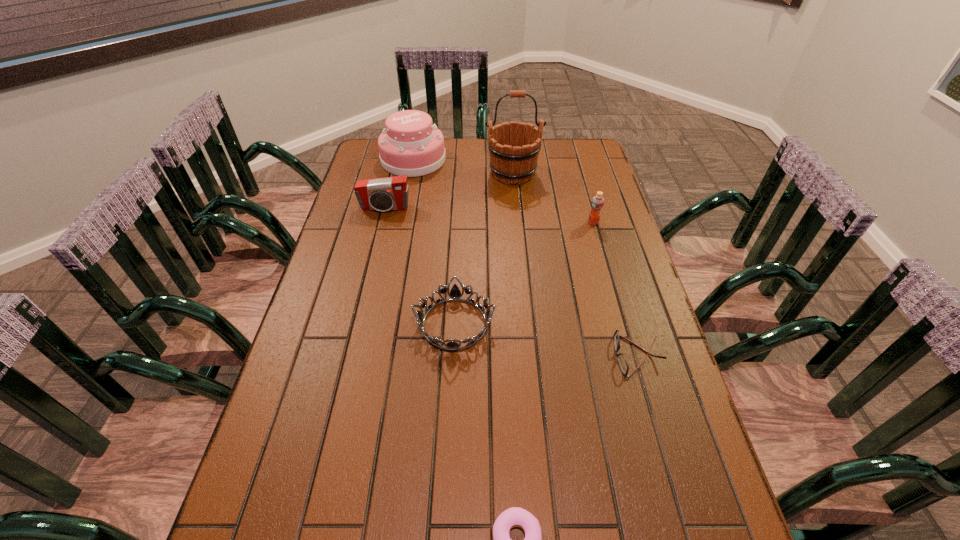
At what (x,y) coordinates should I click in order to perform the action: click on object that is at the far left corner. Please return your answer as a coordinate pair (x, y). This screenshot has width=960, height=540. Looking at the image, I should click on (411, 145).

In order to click on vacant region at the far edge of the desktop in this screenshot , I will do `click(460, 170)`.

In the image, there is a desktop. Where is `vacant area at the left edge`? This screenshot has width=960, height=540. vacant area at the left edge is located at coordinates (309, 458).

In the image, there is a desktop. What are the coordinates of `vacant space at the right edge` in the screenshot? It's located at (566, 186).

Where is `free point at the far right corner`? free point at the far right corner is located at coordinates (569, 157).

I want to click on vacant area that lies between the spectacles and the fourth nearest object, so click(615, 289).

Where is `free space between the wine bucket and the orange juice`? This screenshot has width=960, height=540. free space between the wine bucket and the orange juice is located at coordinates (553, 198).

This screenshot has width=960, height=540. In order to click on free space that is in between the spectacles and the birthday cake in this screenshot , I will do `click(525, 258)`.

What are the coordinates of `blank region between the camera and the orange juice` in the screenshot? It's located at (489, 215).

Image resolution: width=960 pixels, height=540 pixels. I want to click on vacant point located between the tallest object and the spectacles, so click(x=575, y=265).